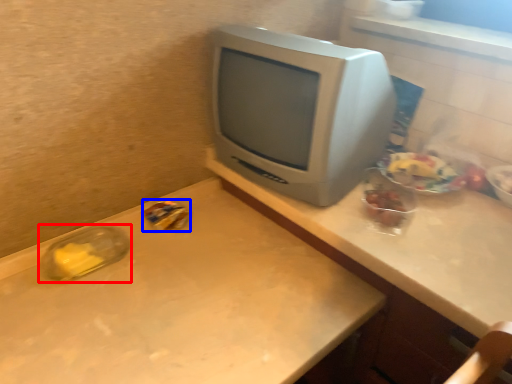
Question: Which object is further to the camera taking this photo, glass jar (highlighted by a red box) or food (highlighted by a blue box)?

Choices:
 (A) glass jar
 (B) food

Answer: (B)